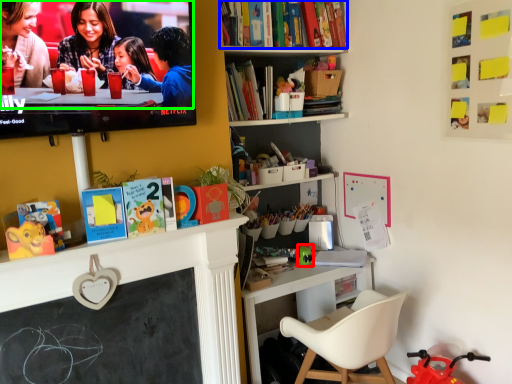
Question: Considering the real-world distances, which object is farthest from toy (highlighted by a red box)? book (highlighted by a blue box) or couple (highlighted by a green box)?

Choices:
 (A) book
 (B) couple

Answer: (B)